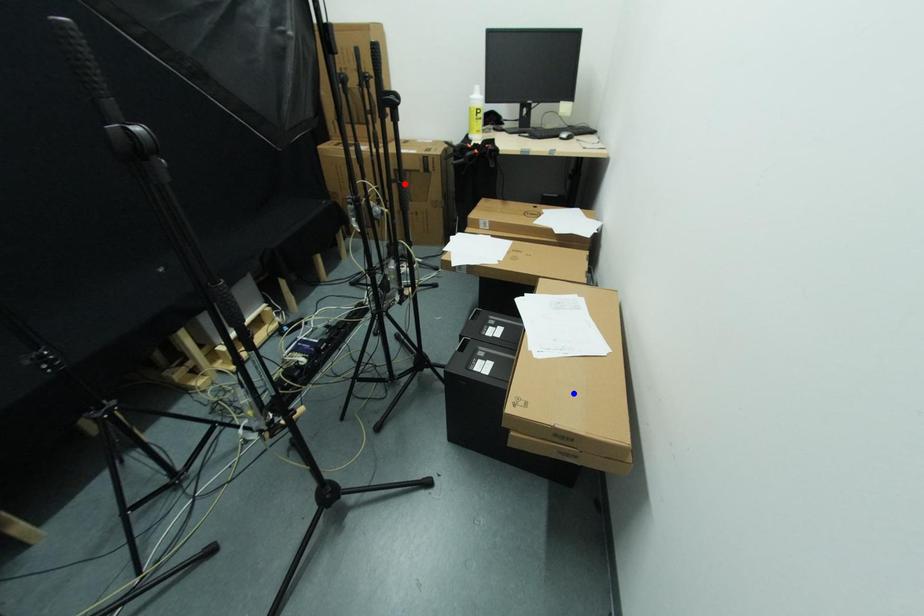
Question: Two points are marked on the image. Which point is closer to the camera?

Choices:
 (A) Blue point is closer.
 (B) Red point is closer.

Answer: (A)